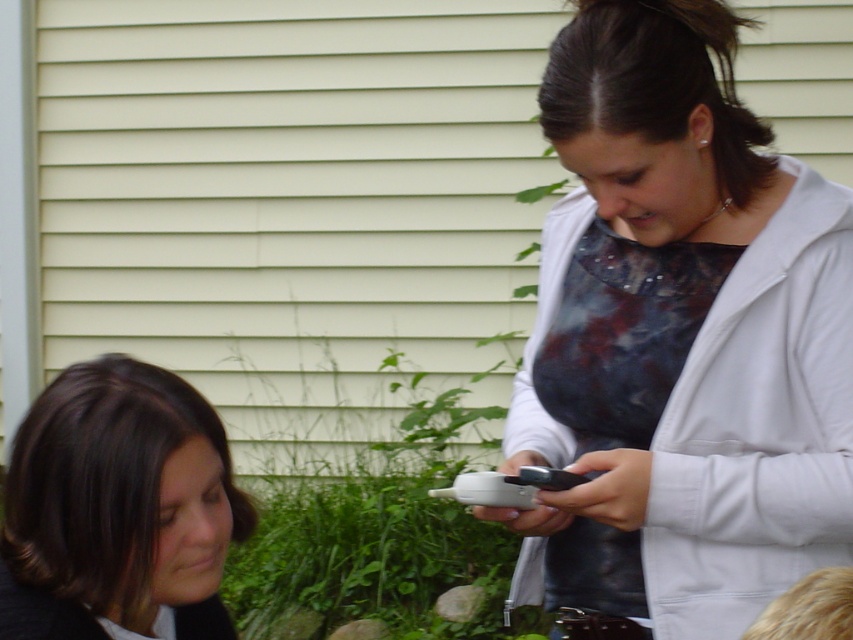
You are a photographer trying to capture a closeup shot of the black plastic smartphone at upper right. However, the matte white jacket at upper right is blocking your view. Can you determine if the smartphone can be moved to the side to avoid the jacket?

The matte white jacket at upper right is bigger than black plastic smartphone at upper right. Since the jacket is larger, there might be enough space to move the smartphone to the side to avoid the obstruction caused by the jacket.

You are a photographer trying to capture a candid shot of the matte white jacket at upper right and the black plastic smartphone at upper right. The camera you are using has a maximum focus range of 12 inches. Can you focus on both objects simultaneously?

The matte white jacket at upper right and black plastic smartphone at upper right are 13.13 inches apart. Since the distance between them exceeds the camera maximum focus range of 12 inches, you cannot focus on both objects simultaneously.